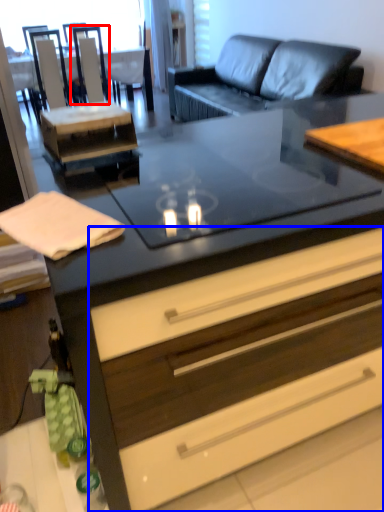
Question: Which point is closer to the camera, armchair (highlighted by a red box) or drawer (highlighted by a blue box)?

Choices:
 (A) armchair
 (B) drawer

Answer: (B)